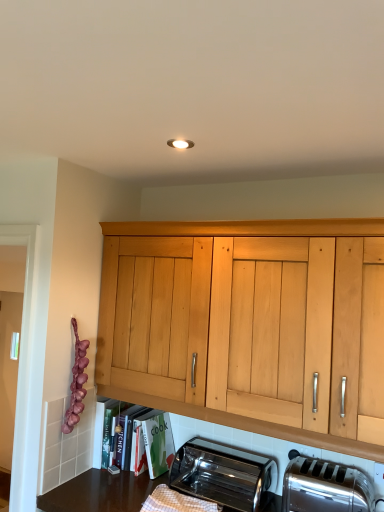
Locate an element on the screen. matte wooden shelf at lower center is located at coordinates (132, 439).

Identify the location of matte wooden shelf at lower center. (132, 439).

Can you confirm if satin silver toaster at lower right, the first toaster positioned from the right, is smaller than matte wooden shelf at lower center?

Yes.

What's the angular difference between satin silver toaster at lower right, the first toaster positioned from the right, and matte wooden shelf at lower center's facing directions?

satin silver toaster at lower right, the first toaster positioned from the right, and matte wooden shelf at lower center are facing 0.00125 degrees away from each other.

From the matte wooden shelf at lower center, count 2nd toasters forward and point to it. Please provide its 2D coordinates.

[(325, 487)]

From a real-world perspective, relative to matte wooden shelf at lower center, is satin silver toaster at lower right, which appears as the 2th toaster when viewed from the left, vertically above or below?

From a real-world perspective, satin silver toaster at lower right, which appears as the 2th toaster when viewed from the left, is physically below matte wooden shelf at lower center.

How different are the orientations of matte wooden shelf at lower center and polished stainless steel toaster at lower center, the second toaster viewed from the right, in degrees?

The angle between the facing direction of matte wooden shelf at lower center and the facing direction of polished stainless steel toaster at lower center, the second toaster viewed from the right, is 0.00138 degrees.

Where is `the 2nd toaster positioned below the matte wooden shelf at lower center (from the image's perspective)`? the 2nd toaster positioned below the matte wooden shelf at lower center (from the image's perspective) is located at coordinates (223, 474).

Does matte wooden shelf at lower center turn towards polished stainless steel toaster at lower center, positioned as the first toaster in left-to-right order?

No, matte wooden shelf at lower center is not aimed at polished stainless steel toaster at lower center, positioned as the first toaster in left-to-right order.

Is point (141, 456) less distant than point (239, 503)?

No, it is not.

In the scene shown: From a real-world perspective, which is physically above, polished stainless steel toaster at lower center, the second toaster viewed from the right, or satin silver toaster at lower right, which appears as the 2th toaster when viewed from the left?

satin silver toaster at lower right, which appears as the 2th toaster when viewed from the left, from a real-world perspective.

Which object is further away from the camera taking this photo, polished stainless steel toaster at lower center, positioned as the first toaster in left-to-right order, or satin silver toaster at lower right, the first toaster positioned from the right?

polished stainless steel toaster at lower center, positioned as the first toaster in left-to-right order, is further from the camera.

From the image's perspective, relative to satin silver toaster at lower right, the first toaster positioned from the right, is polished stainless steel toaster at lower center, positioned as the first toaster in left-to-right order, above or below?

polished stainless steel toaster at lower center, positioned as the first toaster in left-to-right order, is below satin silver toaster at lower right, the first toaster positioned from the right.

Consider the image. Considering the sizes of polished stainless steel toaster at lower center, the second toaster viewed from the right, and satin silver toaster at lower right, the first toaster positioned from the right, in the image, is polished stainless steel toaster at lower center, the second toaster viewed from the right, taller or shorter than satin silver toaster at lower right, the first toaster positioned from the right,?

Considering their sizes, polished stainless steel toaster at lower center, the second toaster viewed from the right, has less height than satin silver toaster at lower right, the first toaster positioned from the right.

At what (x,y) coordinates should I click in order to perform the action: click on the 2nd toaster below when counting from the matte wooden shelf at lower center (from the image's perspective). Please return your answer as a coordinate pair (x, y). Looking at the image, I should click on (223, 474).

Which of these two, polished stainless steel toaster at lower center, positioned as the first toaster in left-to-right order, or matte wooden shelf at lower center, is bigger?

matte wooden shelf at lower center.

From the image's perspective, which object appears higher, polished stainless steel toaster at lower center, positioned as the first toaster in left-to-right order, or matte wooden shelf at lower center?

From the image's view, matte wooden shelf at lower center is above.

Is polished stainless steel toaster at lower center, the second toaster viewed from the right, positioned beyond the bounds of matte wooden shelf at lower center?

polished stainless steel toaster at lower center, the second toaster viewed from the right, lies outside matte wooden shelf at lower center's area.

Consider the image. Considering the relative sizes of matte wooden shelf at lower center and satin silver toaster at lower right, which appears as the 2th toaster when viewed from the left, in the image provided, is matte wooden shelf at lower center shorter than satin silver toaster at lower right, which appears as the 2th toaster when viewed from the left,?

In fact, matte wooden shelf at lower center may be taller than satin silver toaster at lower right, which appears as the 2th toaster when viewed from the left.

Considering the positions of objects matte wooden shelf at lower center and satin silver toaster at lower right, which appears as the 2th toaster when viewed from the left, in the image provided, who is more to the left, matte wooden shelf at lower center or satin silver toaster at lower right, which appears as the 2th toaster when viewed from the left,?

matte wooden shelf at lower center.

Identify the location of shelf on the left of satin silver toaster at lower right, the first toaster positioned from the right. Image resolution: width=384 pixels, height=512 pixels. 132,439.

Which object is wider, matte wooden shelf at lower center or satin silver toaster at lower right, the first toaster positioned from the right?

matte wooden shelf at lower center is wider.

Between satin silver toaster at lower right, the first toaster positioned from the right, and polished stainless steel toaster at lower center, positioned as the first toaster in left-to-right order, which one appears on the right side from the viewer's perspective?

satin silver toaster at lower right, the first toaster positioned from the right.

From a real-world perspective, does satin silver toaster at lower right, which appears as the 2th toaster when viewed from the left, sit lower than polished stainless steel toaster at lower center, the second toaster viewed from the right?

Actually, satin silver toaster at lower right, which appears as the 2th toaster when viewed from the left, is physically above polished stainless steel toaster at lower center, the second toaster viewed from the right, in the real world.

Based on the photo, considering their positions, is satin silver toaster at lower right, which appears as the 2th toaster when viewed from the left, located in front of or behind polished stainless steel toaster at lower center, positioned as the first toaster in left-to-right order?

In the image, satin silver toaster at lower right, which appears as the 2th toaster when viewed from the left, appears in front of polished stainless steel toaster at lower center, positioned as the first toaster in left-to-right order.

I want to click on toaster that is in front of the polished stainless steel toaster at lower center, the second toaster viewed from the right, so (325, 487).

Identify the location of the 2nd toaster counting from the right side of the matte wooden shelf at lower center. (325, 487).

Find the location of `shelf above the polished stainless steel toaster at lower center, the second toaster viewed from the right (from a real-world perspective)`. shelf above the polished stainless steel toaster at lower center, the second toaster viewed from the right (from a real-world perspective) is located at coordinates (132, 439).

Based on their spatial positions, is satin silver toaster at lower right, which appears as the 2th toaster when viewed from the left, or matte wooden shelf at lower center closer to polished stainless steel toaster at lower center, positioned as the first toaster in left-to-right order?

Based on the image, satin silver toaster at lower right, which appears as the 2th toaster when viewed from the left, appears to be nearer to polished stainless steel toaster at lower center, positioned as the first toaster in left-to-right order.

When comparing their distances from matte wooden shelf at lower center, does polished stainless steel toaster at lower center, positioned as the first toaster in left-to-right order, or satin silver toaster at lower right, which appears as the 2th toaster when viewed from the left, seem closer?

polished stainless steel toaster at lower center, positioned as the first toaster in left-to-right order, lies closer to matte wooden shelf at lower center than the other object.

Considering their positions, is satin silver toaster at lower right, the first toaster positioned from the right, positioned further to matte wooden shelf at lower center than polished stainless steel toaster at lower center, the second toaster viewed from the right?

satin silver toaster at lower right, the first toaster positioned from the right, is further to matte wooden shelf at lower center.

Looking at this image, based on their spatial positions, is matte wooden shelf at lower center or satin silver toaster at lower right, the first toaster positioned from the right, closer to polished stainless steel toaster at lower center, positioned as the first toaster in left-to-right order?

satin silver toaster at lower right, the first toaster positioned from the right, is positioned closer to the anchor polished stainless steel toaster at lower center, positioned as the first toaster in left-to-right order.

Considering their positions, is matte wooden shelf at lower center positioned further to satin silver toaster at lower right, the first toaster positioned from the right, than polished stainless steel toaster at lower center, the second toaster viewed from the right?

matte wooden shelf at lower center is positioned further to the anchor satin silver toaster at lower right, the first toaster positioned from the right.

Based on their spatial positions, is polished stainless steel toaster at lower center, positioned as the first toaster in left-to-right order, or matte wooden shelf at lower center further from satin silver toaster at lower right, which appears as the 2th toaster when viewed from the left?

matte wooden shelf at lower center is further to satin silver toaster at lower right, which appears as the 2th toaster when viewed from the left.

Locate an element on the screen. The image size is (384, 512). toaster between matte wooden shelf at lower center and satin silver toaster at lower right, which appears as the 2th toaster when viewed from the left, in the horizontal direction is located at coordinates (223, 474).